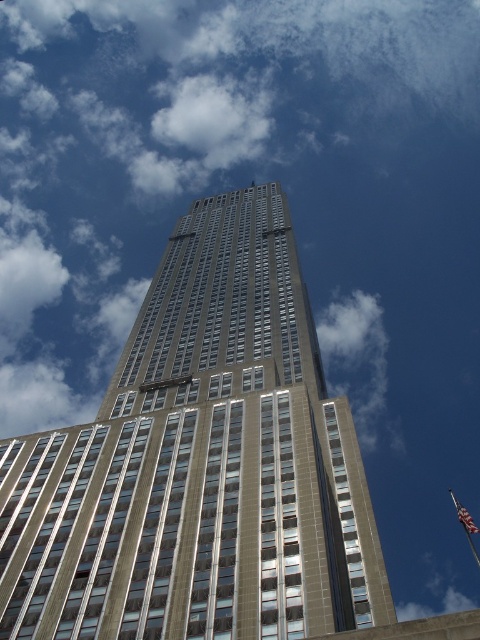
Question: Is beige glass skyscraper at center to the right of american flag at upper right from the viewer's perspective?

Choices:
 (A) yes
 (B) no

Answer: (B)

Question: Does beige glass skyscraper at center appear on the left side of american flag at upper right?

Choices:
 (A) yes
 (B) no

Answer: (A)

Question: Which of the following is the closest to the observer?

Choices:
 (A) (166, 390)
 (B) (470, 531)

Answer: (A)

Question: Does beige glass skyscraper at center have a greater width compared to american flag at upper right?

Choices:
 (A) no
 (B) yes

Answer: (B)

Question: Which point is closer to the camera?

Choices:
 (A) (466, 512)
 (B) (169, 339)

Answer: (B)

Question: Which object appears closest to the camera in this image?

Choices:
 (A) beige glass skyscraper at center
 (B) american flag at upper right

Answer: (A)